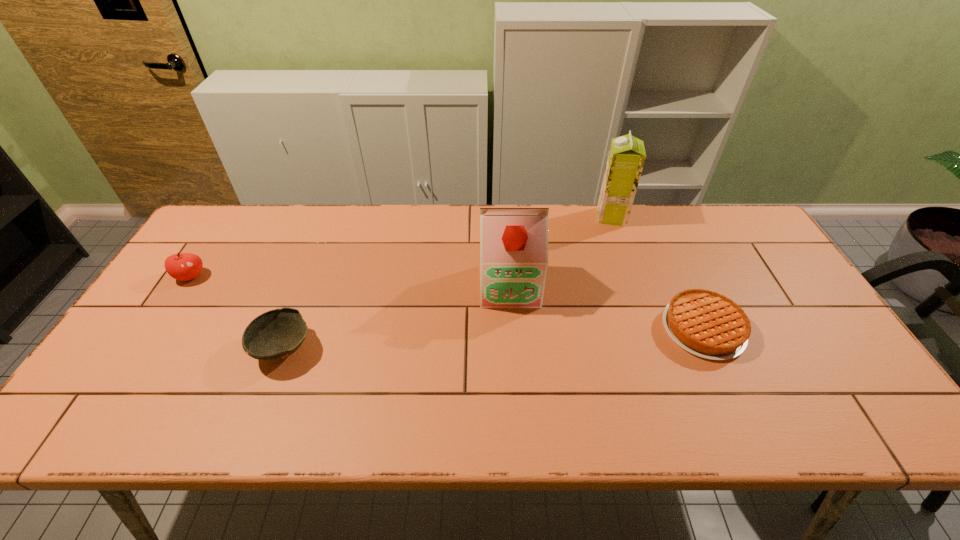
Identify the location of object that stands as the third closest to the apple. (626, 158).

Locate which object is the second closest to the second object from left to right. Please provide its 2D coordinates. Your answer should be formatted as a tuple, i.e. [(x, y)], where the tuple contains the x and y coordinates of a point satisfying the conditions above.

[(513, 241)]

This screenshot has height=540, width=960. Identify the location of free spot that satisfies the following two spatial constraints: 1. on the front side of the fourth tallest object; 2. on the left side of the leftmost object. (144, 348).